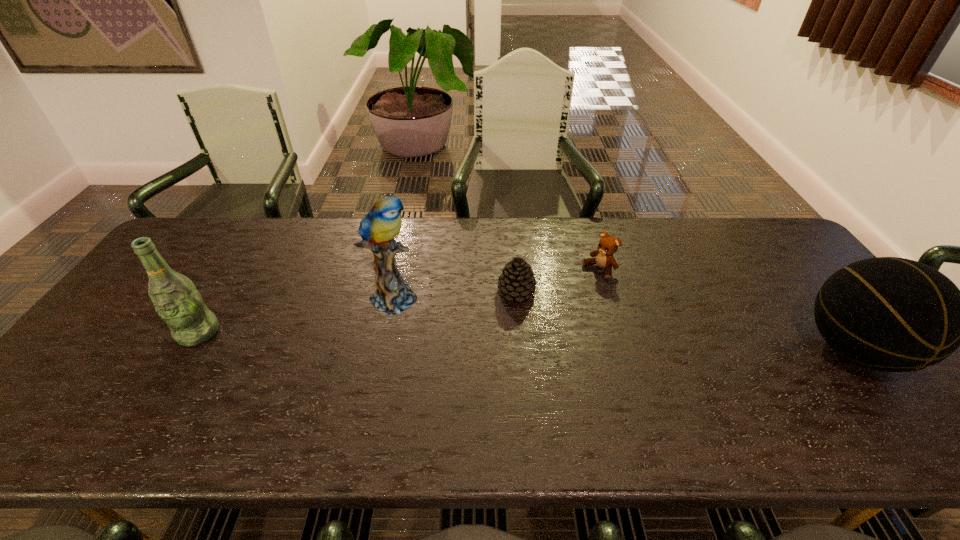
Image resolution: width=960 pixels, height=540 pixels. Identify the location of the leftmost object. (175, 298).

Locate an element on the screen. The height and width of the screenshot is (540, 960). basketball is located at coordinates (890, 314).

This screenshot has height=540, width=960. I want to click on the fourth object from right to left, so click(x=378, y=229).

Find the location of `the tallest object`. the tallest object is located at coordinates (378, 229).

This screenshot has width=960, height=540. I want to click on the fourth object from left to right, so click(x=608, y=245).

At what (x,y) coordinates should I click in order to perform the action: click on the third object from right to left. Please return your answer as a coordinate pair (x, y). The width and height of the screenshot is (960, 540). Looking at the image, I should click on (517, 280).

This screenshot has height=540, width=960. I want to click on blank area located on the surface of the leftmost object, so click(154, 404).

The width and height of the screenshot is (960, 540). I want to click on free point located on the back of the basketball, so click(x=803, y=285).

Where is `vacant space positioned on the face of the tallest object`? This screenshot has height=540, width=960. vacant space positioned on the face of the tallest object is located at coordinates (471, 339).

Where is `vacant region located on the face of the tallest object`? Image resolution: width=960 pixels, height=540 pixels. vacant region located on the face of the tallest object is located at coordinates (518, 364).